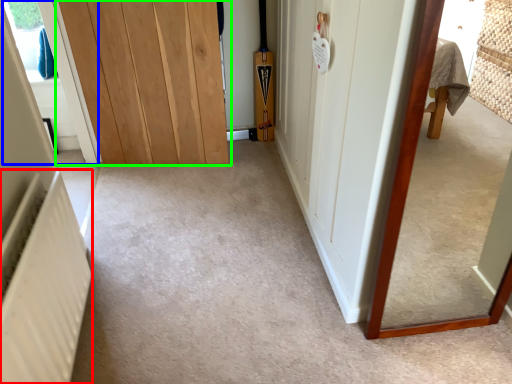
Question: Which object is positioned farthest from radiator (highlighted by a red box)? Select from window (highlighted by a blue box) and door (highlighted by a green box).

Choices:
 (A) window
 (B) door

Answer: (A)